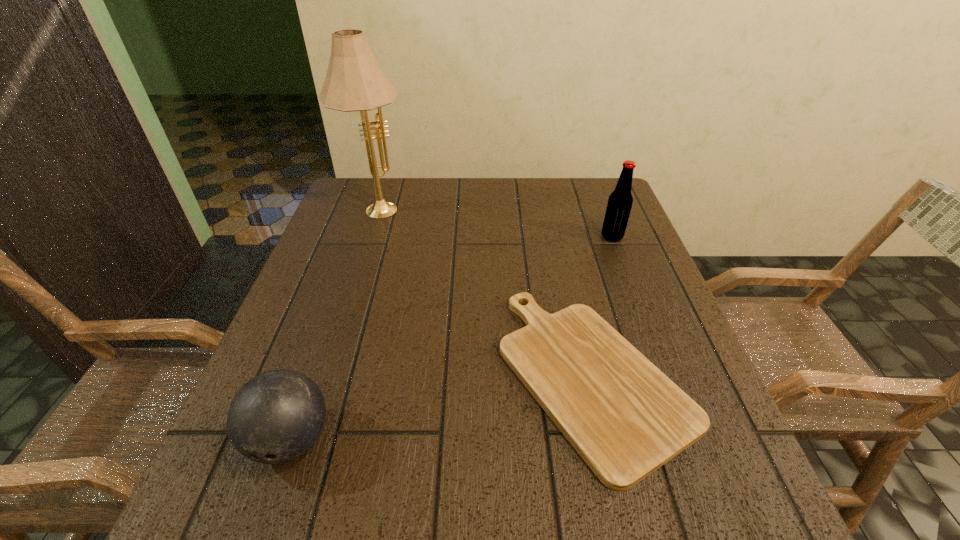
Image resolution: width=960 pixels, height=540 pixels. Find the location of `blank space at the far edge`. blank space at the far edge is located at coordinates (498, 197).

What are the coordinates of `blank space at the near edge` in the screenshot? It's located at (623, 495).

Identify the location of vacant space at the left edge of the desktop. (340, 292).

Locate an element on the screen. Image resolution: width=960 pixels, height=540 pixels. vacant space at the right edge is located at coordinates (635, 235).

Image resolution: width=960 pixels, height=540 pixels. I want to click on vacant space at the far left corner, so click(357, 215).

Image resolution: width=960 pixels, height=540 pixels. I want to click on vacant space at the far right corner of the desktop, so click(581, 191).

Where is `free point between the farthest object and the beer bottle`? free point between the farthest object and the beer bottle is located at coordinates (495, 222).

The height and width of the screenshot is (540, 960). I want to click on empty location between the shortest object and the third nearest object, so click(603, 307).

Find the location of a particular element. The width and height of the screenshot is (960, 540). empty space that is in between the shortest object and the farthest object is located at coordinates click(x=486, y=292).

Locate an element on the screen. The width and height of the screenshot is (960, 540). free space between the beer bottle and the bowling ball is located at coordinates (451, 338).